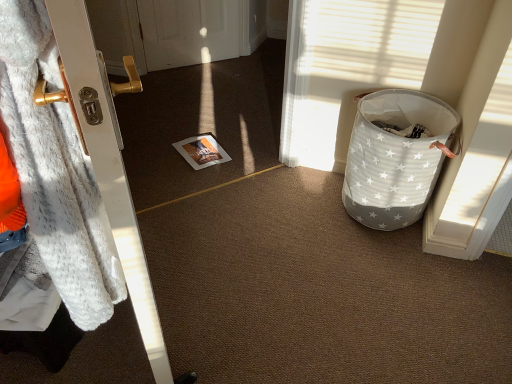
Where is `free location to the left of white star-patterned fabric basket at right`? The image size is (512, 384). free location to the left of white star-patterned fabric basket at right is located at coordinates pyautogui.click(x=304, y=199).